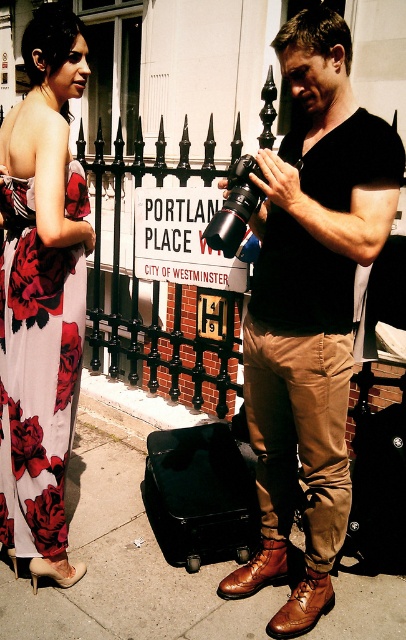
You are standing at point (313, 113) and want to move to the camera. Can you walk directly to it without any obstacles?

The distance between point (313, 113) and the camera is 5.98 feet. Since there are no obstacles mentioned in the scene description, you can walk directly to the camera.

You are standing at the point labeled point (6, 573). If you want to move 3 feet closer to the viewer, where would you be?

Moving 3 feet closer to the viewer from point (6, 573) would place you at 7.51 feet minus 3 feet, resulting in a distance of 4.51 feet from the viewer.

You are a fashion designer observing a man in the city. You notice the matte black shirt at center and the brown leather shoes at lower center. Which item is positioned higher on his body?

The matte black shirt at center is positioned higher on his body than the brown leather shoes at lower center.